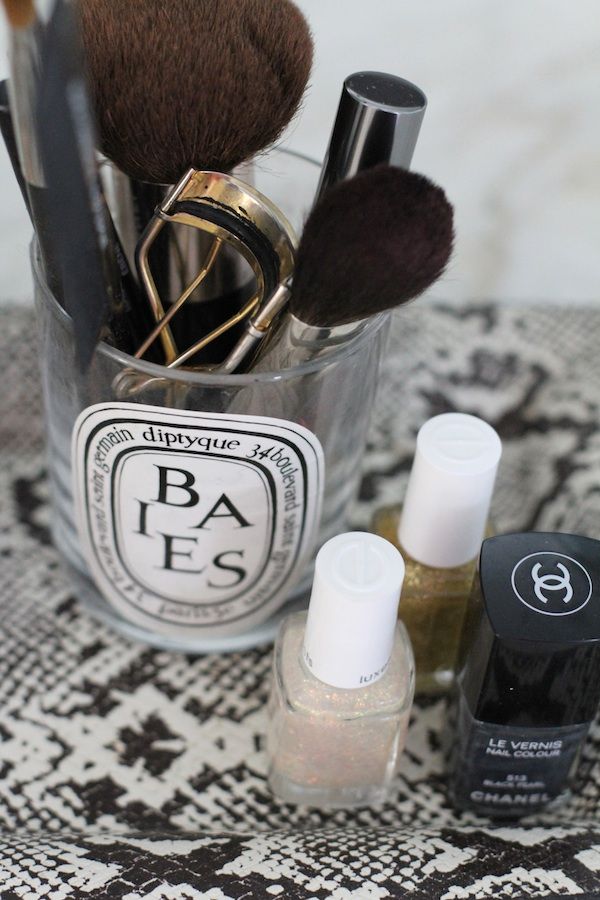
Find the location of a particular element. Image resolution: width=600 pixels, height=900 pixels. makeup tool is located at coordinates (229, 194).